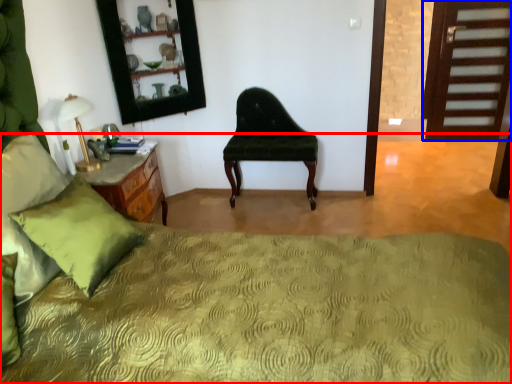
Question: Which of the following is the farthest to the observer, bed (highlighted by a red box) or door (highlighted by a blue box)?

Choices:
 (A) bed
 (B) door

Answer: (B)